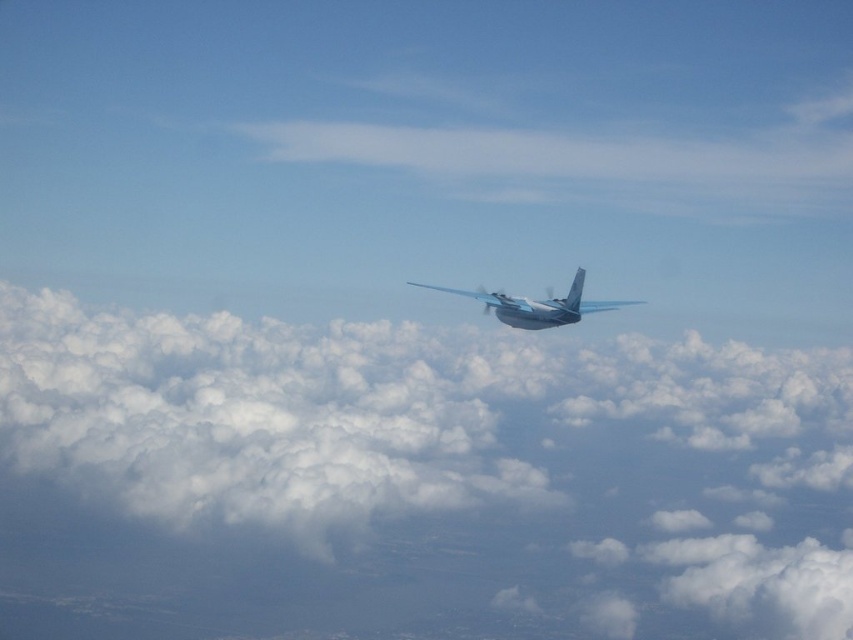
Question: Which of the following is the farthest from the observer?

Choices:
 (A) white fluffy cloud at center
 (B) metallic silver airplane at center

Answer: (A)

Question: Can you confirm if white fluffy cloud at center is thinner than metallic silver airplane at center?

Choices:
 (A) no
 (B) yes

Answer: (A)

Question: Can you confirm if white fluffy cloud at center is bigger than metallic silver airplane at center?

Choices:
 (A) no
 (B) yes

Answer: (B)

Question: Which point is farther to the camera?

Choices:
 (A) (328, 412)
 (B) (547, 308)

Answer: (A)

Question: Among these points, which one is nearest to the camera?

Choices:
 (A) (509, 314)
 (B) (741, 625)

Answer: (A)

Question: Considering the relative positions of white fluffy cloud at center and metallic silver airplane at center in the image provided, where is white fluffy cloud at center located with respect to metallic silver airplane at center?

Choices:
 (A) below
 (B) above

Answer: (A)